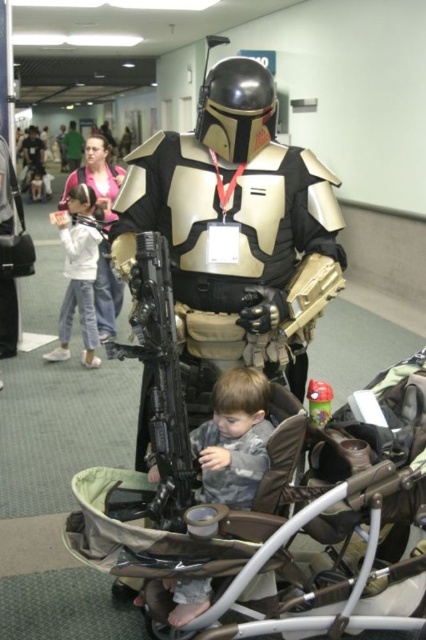
Can you confirm if matte black helmet at upper center is wider than green fabric shirt at center?

Incorrect, matte black helmet at upper center's width does not surpass green fabric shirt at center's.

Is matte black helmet at upper center below green fabric shirt at center?

Yes.

Find the location of a particular element. matte black helmet at upper center is located at coordinates (106, 294).

Which is above, gray soft fabric toddler at center or white soft pants at left?

white soft pants at left

Can you confirm if gray soft fabric toddler at center is taller than white soft pants at left?

No.

Is point (209, 426) closer to viewer compared to point (71, 253)?

Yes, it is in front of point (71, 253).

You are a GUI agent. You are given a task and a screenshot of the screen. Output one action in this format:
    pyautogui.click(x=<x>, y=<y>)
    Task: Click on the gray soft fabric toddler at center
    Image resolution: width=426 pixels, height=640 pixels.
    Given the screenshot: What is the action you would take?
    pyautogui.click(x=233, y=438)

Between brown fabric baby carriage at center and white soft pants at left, which one appears on the right side from the viewer's perspective?

brown fabric baby carriage at center

Locate an element on the screen. brown fabric baby carriage at center is located at coordinates (267, 515).

Identify the location of brown fabric baby carriage at center. (267, 515).